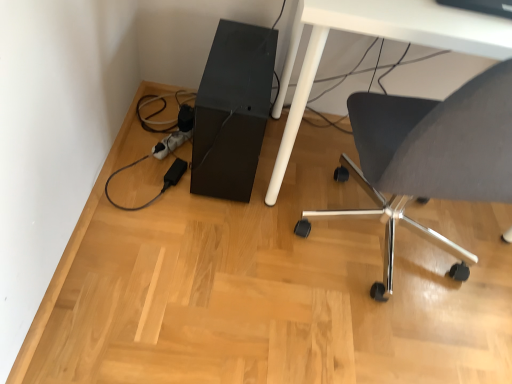
Locate an element on the screen. The height and width of the screenshot is (384, 512). empty space that is to the right of black matte computer tower at lower center is located at coordinates (321, 182).